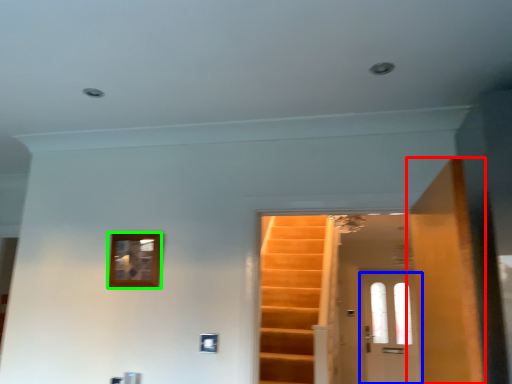
Question: Which is nearer to the door (highlighted by a red box)? door (highlighted by a blue box) or picture frame (highlighted by a green box).

Choices:
 (A) door
 (B) picture frame

Answer: (B)